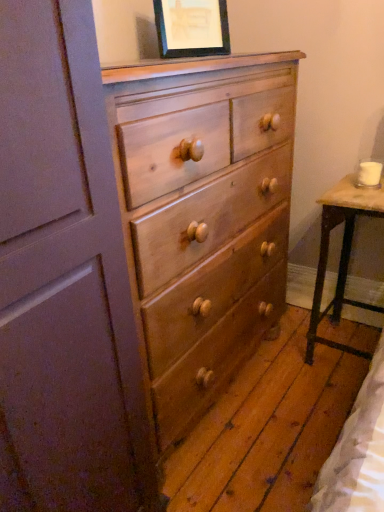
I want to click on vacant space positioned to the left of wooden table at right, so (x=297, y=366).